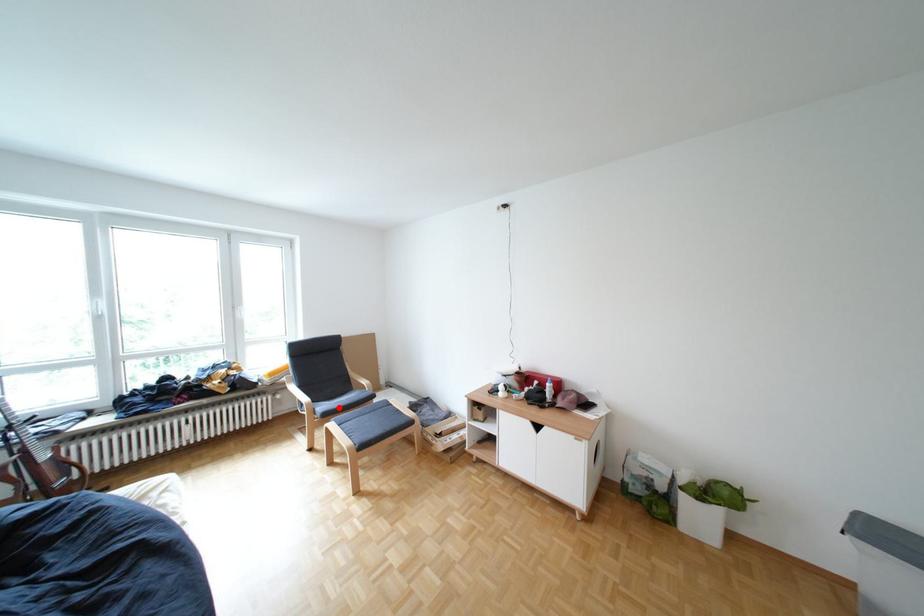
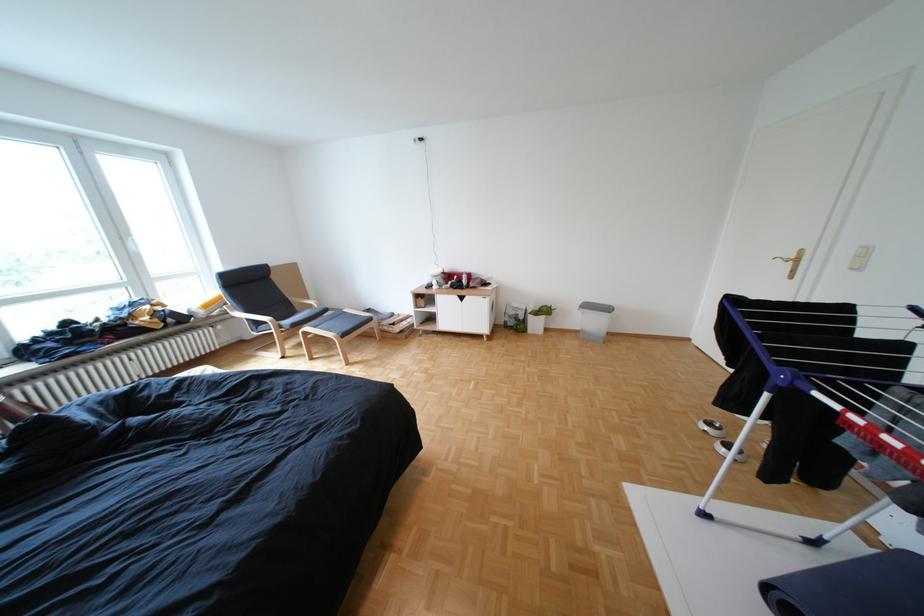
Question: I am providing you with two images of the same scene from different viewpoints. In image1, a red point is highlighted. Considering the same 3D point in image2, which of the following is correct?

Choices:
 (A) It is closer
 (B) It is farther

Answer: (A)